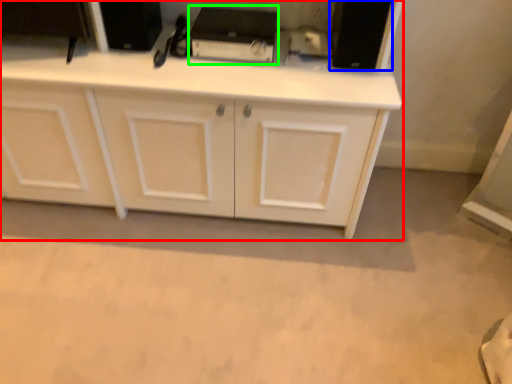
Question: Which object is the farthest from cabinetry (highlighted by a red box)? Choose among these: appliance (highlighted by a blue box) or appliance (highlighted by a green box).

Choices:
 (A) appliance
 (B) appliance

Answer: (A)